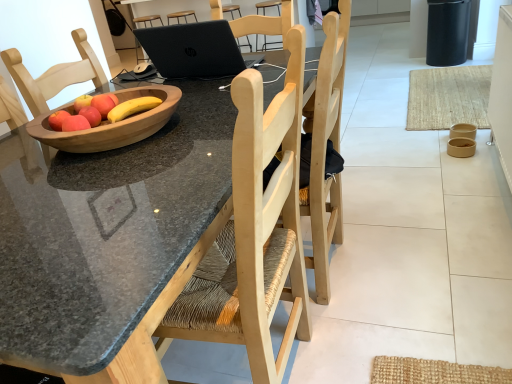
I want to click on vacant area that lies to the right of granite table at center, so click(x=419, y=270).